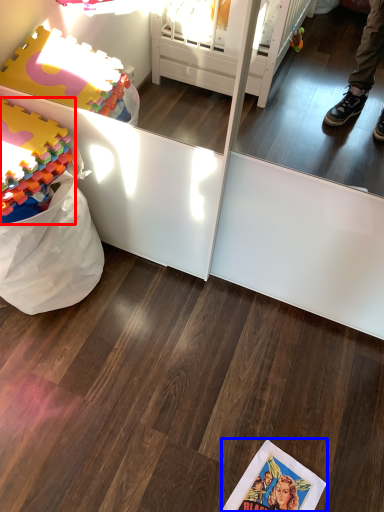
Question: Which of the following is the closest to the observer, toy (highlighted by a red box) or comic book (highlighted by a blue box)?

Choices:
 (A) toy
 (B) comic book

Answer: (A)